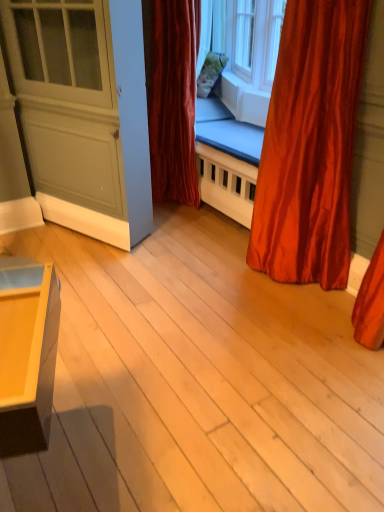
Question: Would you say velvet red curtain at center, which is the 2th curtain from front to back, is inside or outside clear glass window at upper center?

Choices:
 (A) inside
 (B) outside

Answer: (B)

Question: Considering the positions of velvet red curtain at center, the 1th curtain when ordered from back to front, and clear glass window at upper center in the image, is velvet red curtain at center, the 1th curtain when ordered from back to front, taller or shorter than clear glass window at upper center?

Choices:
 (A) short
 (B) tall

Answer: (B)

Question: Considering the real-world distances, which object is closest to the matte gray screen door at left?

Choices:
 (A) velvet red curtain at center, the 1th curtain when ordered from back to front
 (B) satin red curtain at right, marked as the 1th curtain in a front-to-back arrangement
 (C) clear glass window at upper center

Answer: (A)

Question: Estimate the real-world distances between objects in this image. Which object is closer to the velvet red curtain at center, which is the 1th curtain in left-to-right order?

Choices:
 (A) clear glass window at upper center
 (B) matte gray screen door at left
 (C) satin red curtain at right, marked as the 1th curtain in a front-to-back arrangement

Answer: (B)